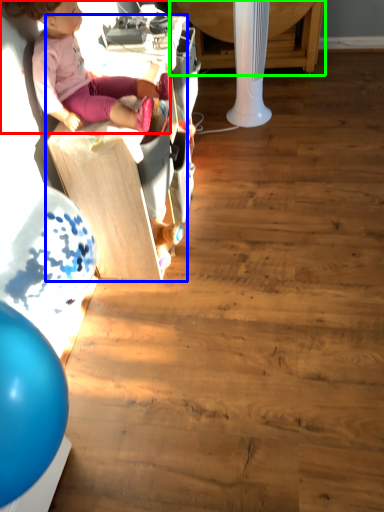
Question: Estimate the real-world distances between objects in this image. Which object is closer to person (highlighted by a red box), furniture (highlighted by a blue box) or table (highlighted by a green box)?

Choices:
 (A) furniture
 (B) table

Answer: (A)